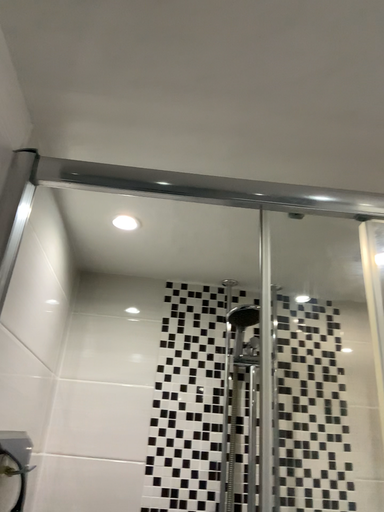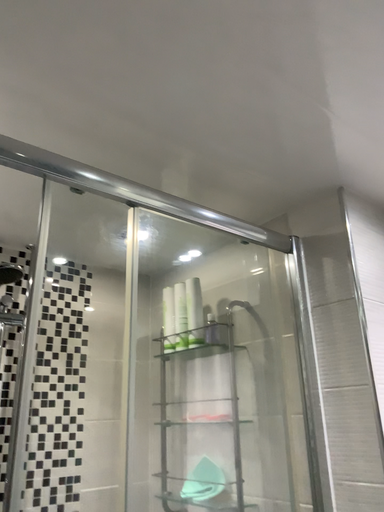
Question: Which way did the camera rotate in the video?

Choices:
 (A) rotated right
 (B) rotated left

Answer: (A)